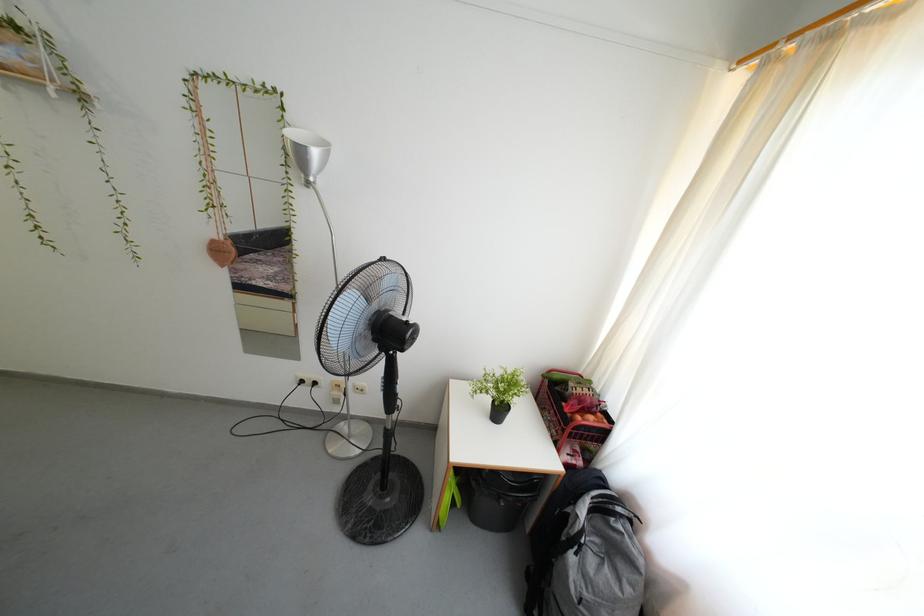
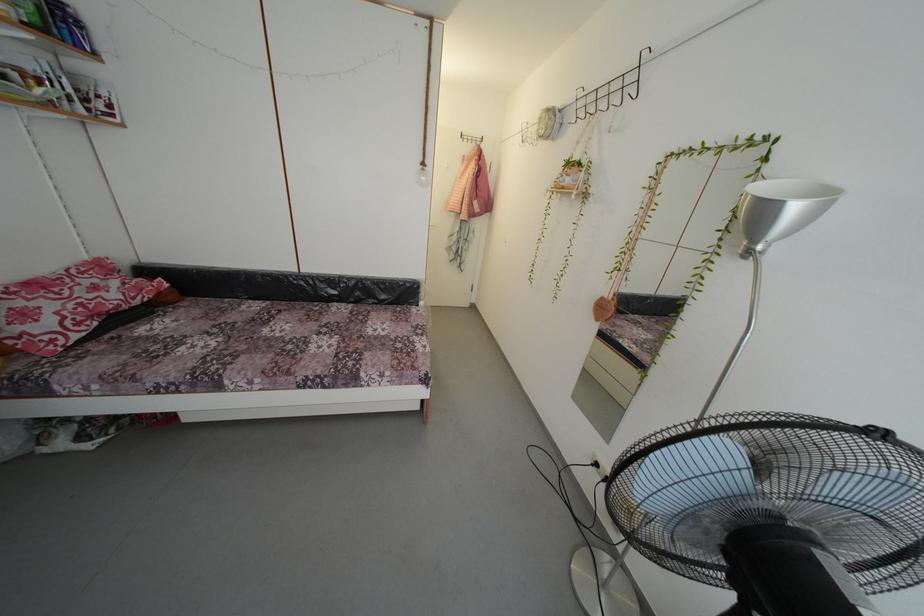
In the second image, find the point that corresponds to point (297, 140) in the first image.

(766, 195)